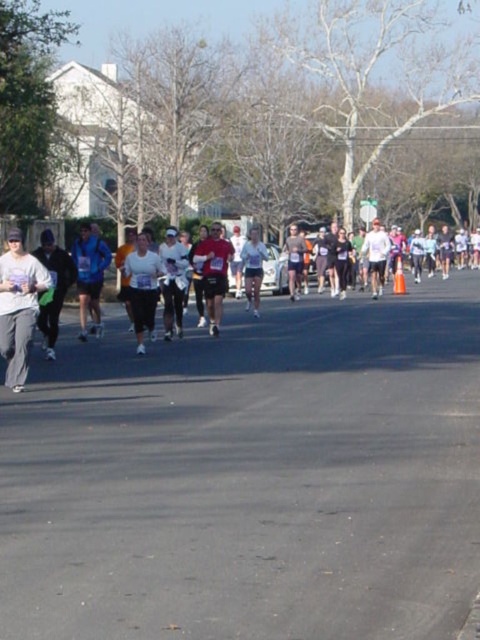
You are a photographer standing at the center of the road. You want to take a photo of the gray matte pants at left. Where should you aim your camera relative to your current position?

You should aim your camera to the left since the gray matte pants at left is located at point (19, 307), which is to the left of the center.

You are a photographer at the marathon event and want to capture both the white matte shirt at center and the matte red shirt at center in your shot. Which runner should you focus on first to ensure both are in focus?

You should focus on the white matte shirt at center first since it is closer to the viewer than the matte red shirt at center, allowing both to be in focus when using a shallow depth of field.

You are a photographer positioned at the starting line of the marathon. You want to capture a photo that includes both the gray matte pants at left and the white matte shirt at center. Which runner should be closer to the camera to ensure both are in focus?

The gray matte pants at left is in front of the white matte shirt at center, so to ensure both are in focus, the photographer should position themselves so that the gray matte pants at left is closer to the camera. This way, the depth of field can include both the foreground and background subjects effectively.